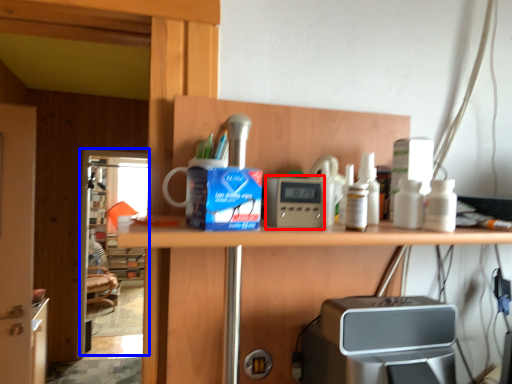
Question: Which object appears farthest to the camera in this image, appliance (highlighted by a red box) or screen door (highlighted by a blue box)?

Choices:
 (A) appliance
 (B) screen door

Answer: (B)